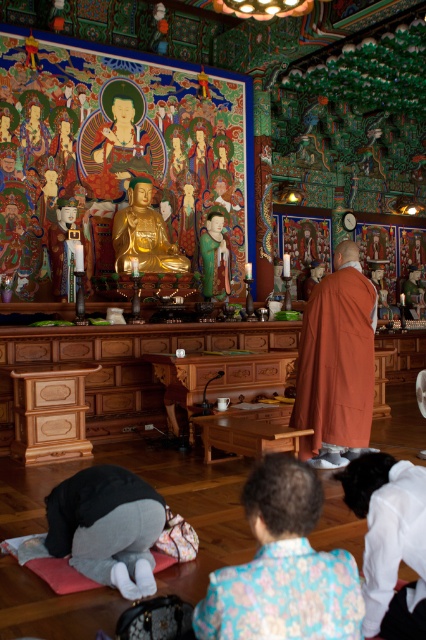
You are a visitor standing in the temple and want to place a small offering between the floral silk robe at lower center and the orange cotton robe at center. How far apart are these two robes so you can position your offering correctly?

The floral silk robe at lower center and orange cotton robe at center are 3.53 meters apart.

You are a visitor standing at the entrance of the temple and want to place a bouquet of flowers between the orange cotton robe at center and the white matte robe at lower center. The bouquet requires 3 feet of space. Can you fit it between them?

The orange cotton robe at center is 9.51 feet away from the white matte robe at lower center, so yes, the bouquet requiring 3 feet of space can be placed between them since there is enough distance available.